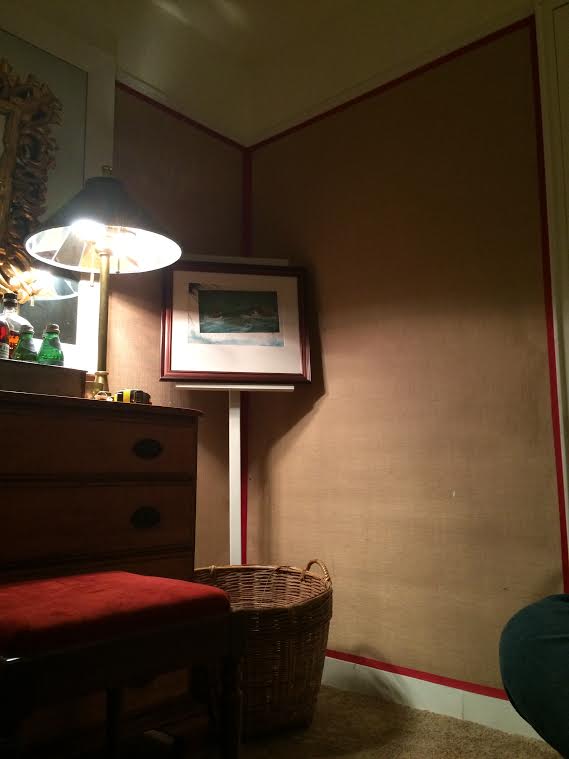
At what (x,y) coordinates should I click in order to perform the action: click on brown rug. Please return your answer as a coordinate pair (x, y). The height and width of the screenshot is (759, 569). Looking at the image, I should click on (410, 735).